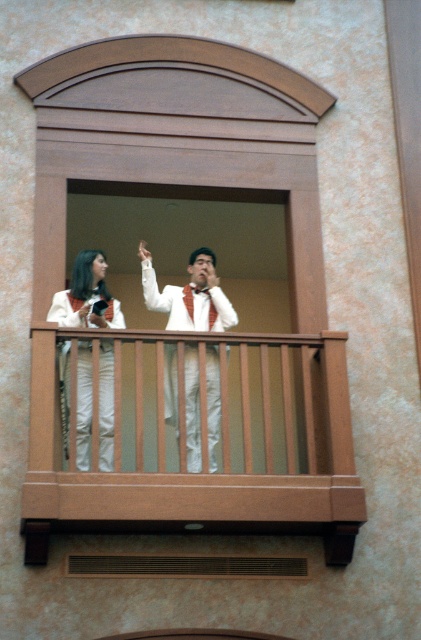
Measure the distance between point (124, 481) and camera.

Point (124, 481) and camera are 94.17 feet apart.

Is brown wooden balustrade at center above white matte pants at center?

Incorrect, brown wooden balustrade at center is not positioned above white matte pants at center.

The image size is (421, 640). In order to click on brown wooden balustrade at center in this screenshot , I will do tap(197, 438).

Where is `brown wooden balustrade at center`? The image size is (421, 640). brown wooden balustrade at center is located at coordinates (197, 438).

Between brown wooden balcony at center and white satin suit at center, which one is positioned higher?

white satin suit at center is above.

Is point (106, 148) behind point (210, 385)?

Yes, it is behind point (210, 385).

Identify the location of brown wooden balcony at center. (194, 300).

In order to click on brown wooden balcony at center in this screenshot , I will do `click(194, 300)`.

Is brown wooden balcony at center to the left of brown wooden balustrade at center from the viewer's perspective?

No, brown wooden balcony at center is not to the left of brown wooden balustrade at center.

In the scene shown: Measure the distance between brown wooden balcony at center and brown wooden balustrade at center.

brown wooden balcony at center and brown wooden balustrade at center are 6.41 feet apart from each other.

Is point (223, 125) in front of point (92, 433)?

No, it is behind (92, 433).

In order to click on brown wooden balcony at center in this screenshot , I will do `click(194, 300)`.